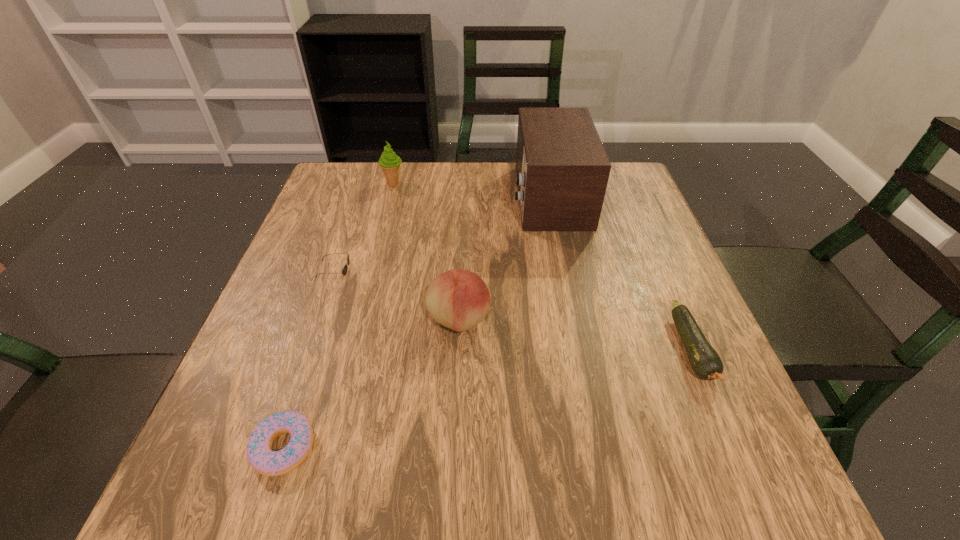
Identify the location of free space located on the front-facing side of the radio receiver. The height and width of the screenshot is (540, 960). (378, 197).

Identify the location of free region located 0.090m on the front-facing side of the radio receiver. (x=478, y=197).

The image size is (960, 540). Find the location of `vacant area situated 0.140m on the front-facing side of the radio receiver`. vacant area situated 0.140m on the front-facing side of the radio receiver is located at coordinates point(460,197).

This screenshot has width=960, height=540. In order to click on vacant space situated 0.370m on the right of the fifth shortest object in this screenshot , I will do `click(537, 184)`.

At what (x,y) coordinates should I click in order to perform the action: click on free region located on the back of the peach. Please return your answer as a coordinate pair (x, y). Image resolution: width=960 pixels, height=540 pixels. Looking at the image, I should click on click(x=464, y=207).

The height and width of the screenshot is (540, 960). Find the location of `vacant space located in front of the lenses of the third shortest object`. vacant space located in front of the lenses of the third shortest object is located at coordinates (465, 282).

At what (x,y) coordinates should I click in order to perform the action: click on free location located at the blossom end of the second shortest object. Please return your answer as a coordinate pair (x, y). Looking at the image, I should click on tap(749, 483).

Locate an element on the screen. This screenshot has height=540, width=960. vacant space located on the back of the nearest object is located at coordinates pyautogui.click(x=311, y=367).

Find the location of a particular element. radio receiver that is at the far edge is located at coordinates (562, 170).

You are a GUI agent. You are given a task and a screenshot of the screen. Output one action in this format:
    pyautogui.click(x=<x>, y=<y>)
    Task: Click on the icecream located at the far edge
    
    Given the screenshot: What is the action you would take?
    pyautogui.click(x=390, y=163)